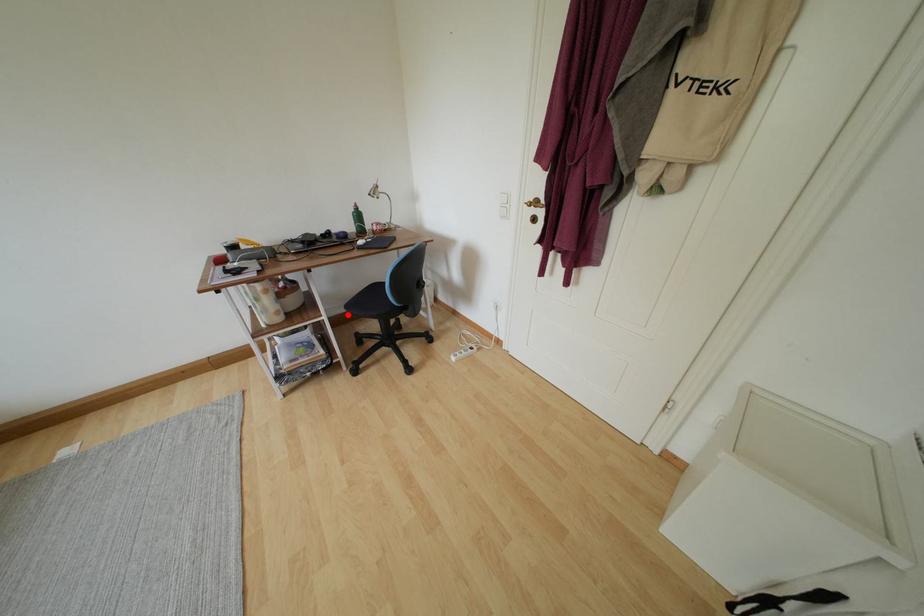
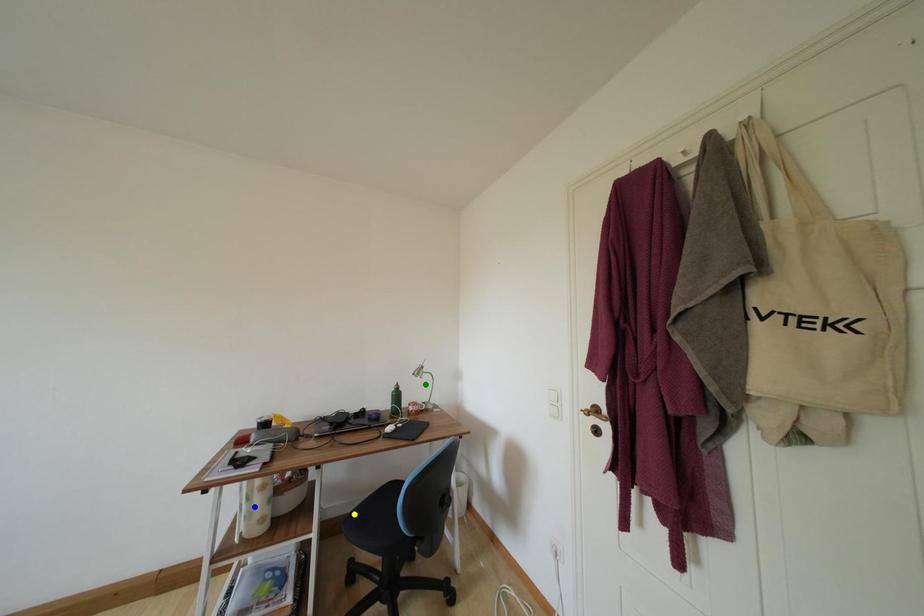
Question: I am providing you with two images of the same scene from different viewpoints. A red point is marked on the first image. You are given multiple points on the second image. Which mark in image 2 goes with the point in image 1?

Choices:
 (A) yellow point
 (B) blue point
 (C) green point

Answer: (A)